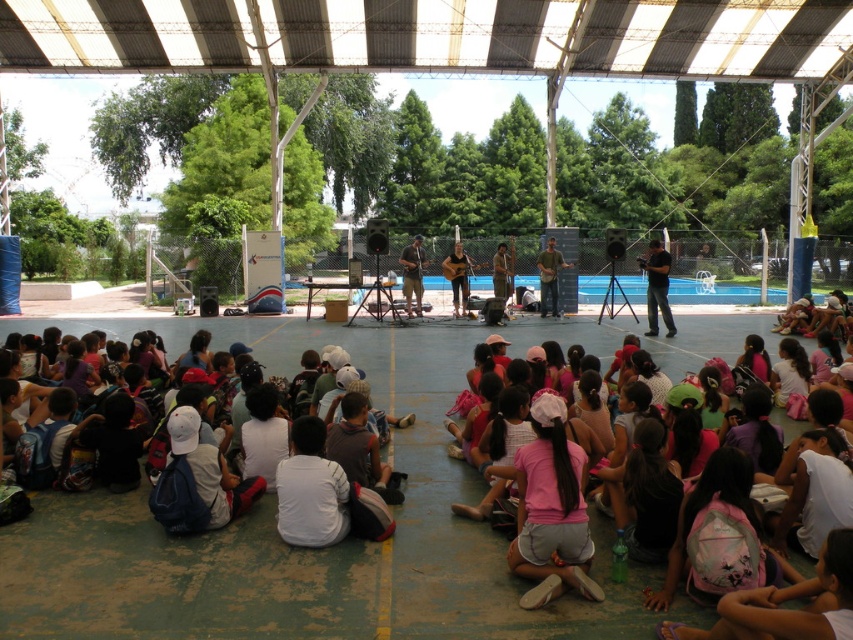
Does pink fabric backpacks at lower center appear on the right side of black matte camera at center?

No, pink fabric backpacks at lower center is not to the right of black matte camera at center.

Between pink fabric backpacks at lower center and black matte camera at center, which one is positioned higher?

Positioned higher is black matte camera at center.

This screenshot has width=853, height=640. What do you see at coordinates (701, 339) in the screenshot?
I see `pink fabric backpacks at lower center` at bounding box center [701, 339].

You are a GUI agent. You are given a task and a screenshot of the screen. Output one action in this format:
    pyautogui.click(x=<x>, y=<y>)
    Task: Click on the pink fabric backpacks at lower center
    
    Given the screenshot: What is the action you would take?
    pyautogui.click(x=701, y=339)